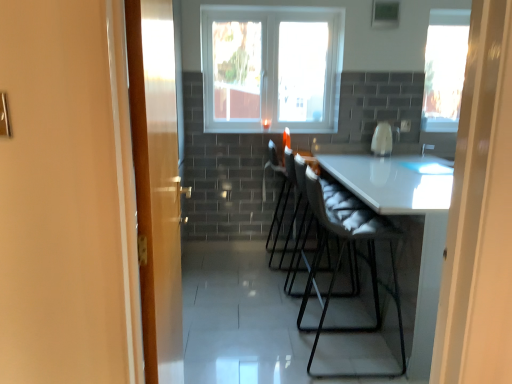
Question: Is transparent glass window at upper right, the first window from the right, taller or shorter than white glossy coffee machine at center?

Choices:
 (A) tall
 (B) short

Answer: (A)

Question: Looking at their shapes, would you say transparent glass window at upper right, the first window from the right, is wider or thinner than white glossy coffee machine at center?

Choices:
 (A) wide
 (B) thin

Answer: (B)

Question: Estimate the real-world distances between objects in this image. Which object is closer to the white fabric chair at center, positioned as the second chair in back-to-front order?

Choices:
 (A) white fabric chair at center, which ranks as the 1th chair in back-to-front order
 (B) transparent glass window at center, the second window in the right-to-left sequence
 (C) white fabric folding chair at center
 (D) transparent glass window at upper right, the first window from the right
 (E) white glossy coffee machine at center

Answer: (C)

Question: Estimate the real-world distances between objects in this image. Which object is closer to the white fabric folding chair at center?

Choices:
 (A) white fabric chair at center, positioned as the second chair in back-to-front order
 (B) transparent glass window at center, the second window in the right-to-left sequence
 (C) white glossy coffee machine at center
 (D) transparent glass window at upper right, the second window when ordered from left to right
 (E) wooden door at left

Answer: (A)